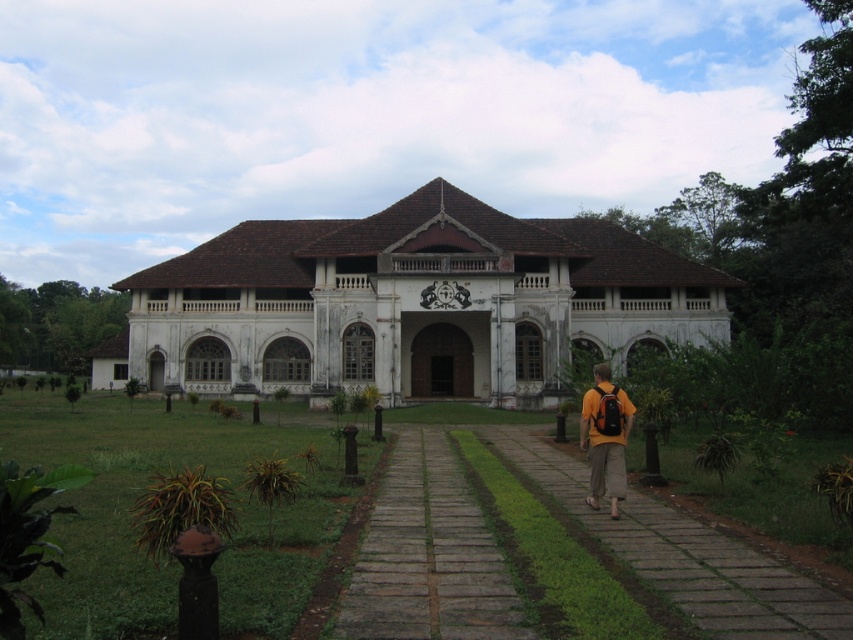
Based on the photo, you are standing at the entrance of the building and see the brick paved walkway at center and the orange fabric backpack at center. Which object is positioned to the left of the other?

The brick paved walkway at center is to the left of orange fabric backpack at center.

Based on the photo, you are standing in front of the building and want to walk towards the entrance. Which path should you take if you prefer a surface that is lower to the ground? Please choose between the gray stone path at center and the brick paved walkway at center.

The gray stone path at center is not as tall as the brick paved walkway at center, so you should choose the gray stone path at center as it is lower to the ground.

You are standing in front of the grand old building and want to walk from the point at coordinates point [372,564] to the point at coordinates point [596,406]. Which direction should you move to reach your destination?

To move from point [372,564] to point [596,406], you should move towards the upper left direction since point [596,406] is located above and to the left of point [372,564].